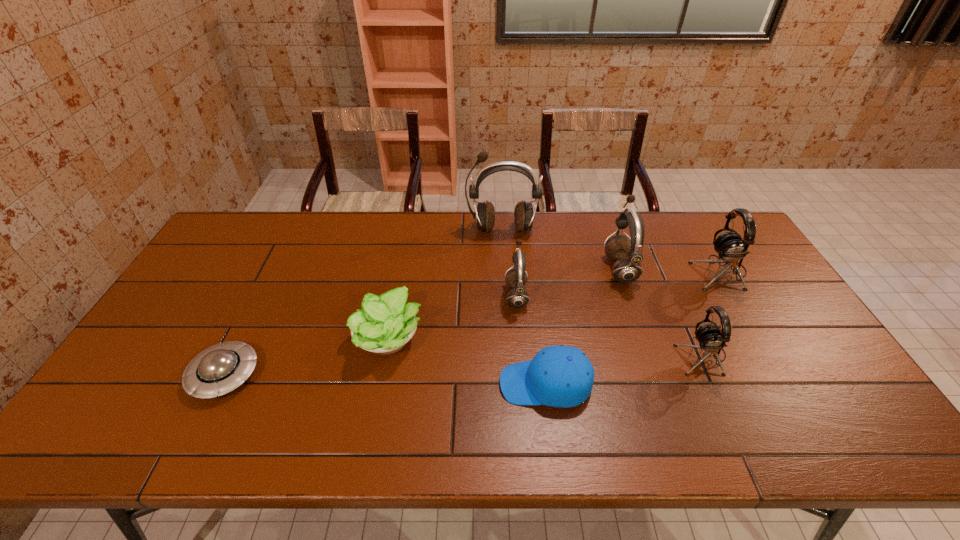
In order to click on the tallest earphone in this screenshot , I will do `click(484, 216)`.

Find the location of a particular element. the tallest object is located at coordinates (484, 216).

Where is `the farther black earphone`? This screenshot has height=540, width=960. the farther black earphone is located at coordinates (730, 247).

Identify the location of the rightmost object. The width and height of the screenshot is (960, 540). (730, 247).

I want to click on the second smallest brown earphone, so click(627, 253).

Locate an element on the screen. the sixth object from left to right is located at coordinates (627, 253).

Where is `the smallest brown earphone`? This screenshot has height=540, width=960. the smallest brown earphone is located at coordinates (518, 297).

Locate an element on the screen. the fourth earphone from left to right is located at coordinates (711, 339).

The image size is (960, 540). I want to click on the nearest earphone, so click(x=711, y=339).

Identify the location of blue cap. (561, 376).